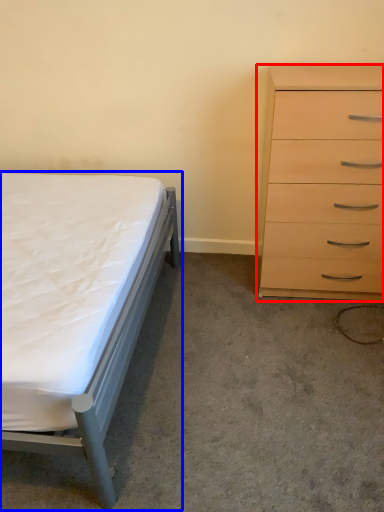
Question: Which object is further to the camera taking this photo, chest of drawers (highlighted by a red box) or bed (highlighted by a blue box)?

Choices:
 (A) chest of drawers
 (B) bed

Answer: (A)